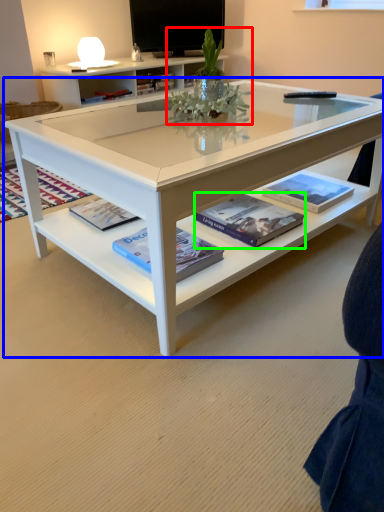
Question: Which object is the farthest from floral arrangement (highlighted by a red box)? Choose among these: coffee table (highlighted by a blue box) or book (highlighted by a green box).

Choices:
 (A) coffee table
 (B) book

Answer: (A)